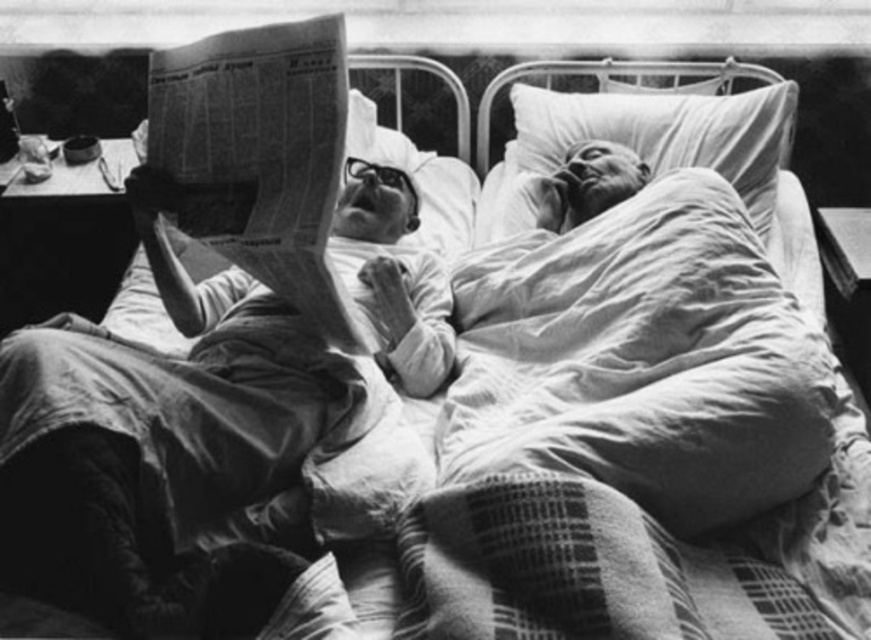
Question: Where is smooth paper newspaper at upper left located in relation to printed newspaper at upper left in the image?

Choices:
 (A) right
 (B) left

Answer: (B)

Question: Estimate the real-world distances between objects in this image. Which object is farther from the smooth paper newspaper at upper left?

Choices:
 (A) smooth skin face at upper right
 (B) white soft pillow at upper right

Answer: (B)

Question: Which point appears farthest from the camera in this image?

Choices:
 (A) 350,186
 (B) 582,204
 (C) 793,97
 (D) 280,45

Answer: (C)

Question: Where is printed newspaper at upper left located in relation to white soft pillow at upper right in the image?

Choices:
 (A) below
 (B) above

Answer: (A)

Question: Is printed newspaper at upper left smaller than smooth skin face at upper right?

Choices:
 (A) yes
 (B) no

Answer: (B)

Question: Which object appears closest to the camera in this image?

Choices:
 (A) white soft pillow at upper right
 (B) printed newspaper at upper left
 (C) smooth skin face at upper right

Answer: (B)